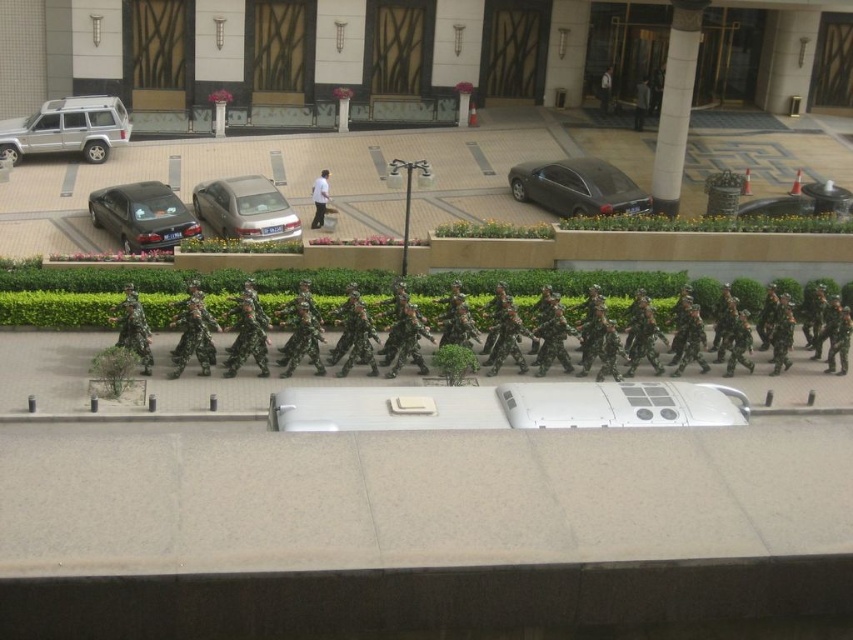
Is point (51, 102) closer to camera compared to point (534, 163)?

No, it is not.

How much distance is there between silver metallic suv at upper left and satin black sedan at center?

47.70 feet

Does point (49, 100) come farther from viewer compared to point (566, 157)?

Yes, it is behind point (566, 157).

Where is `silver metallic suv at upper left`? The image size is (853, 640). silver metallic suv at upper left is located at coordinates (67, 129).

Is shiny black sedan at left shorter than silver metallic sedan at center?

Incorrect, shiny black sedan at left's height does not fall short of silver metallic sedan at center's.

This screenshot has height=640, width=853. Describe the element at coordinates (141, 216) in the screenshot. I see `shiny black sedan at left` at that location.

At what (x,y) coordinates should I click in order to perform the action: click on shiny black sedan at left. Please return your answer as a coordinate pair (x, y). This screenshot has width=853, height=640. Looking at the image, I should click on (141, 216).

Does silver metallic suv at upper left have a lesser width compared to shiny black sedan at left?

In fact, silver metallic suv at upper left might be wider than shiny black sedan at left.

This screenshot has width=853, height=640. What are the coordinates of `silver metallic suv at upper left` in the screenshot? It's located at (67, 129).

Between point (80, 99) and point (131, 195), which one is positioned in front?

Positioned in front is point (131, 195).

What are the coordinates of `silver metallic suv at upper left` in the screenshot? It's located at (67, 129).